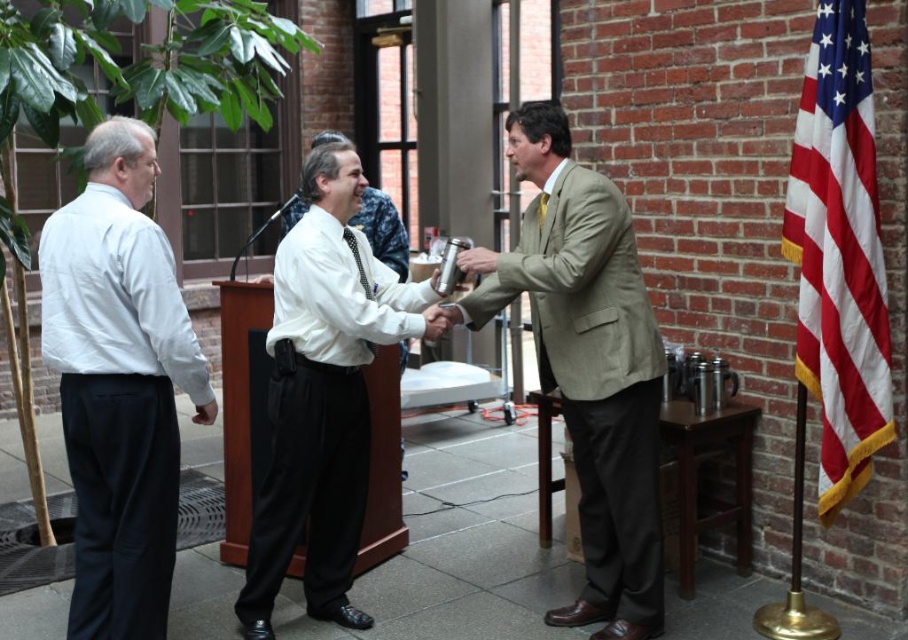
Question: Is white shirt at center above matte black tie at center?

Choices:
 (A) no
 (B) yes

Answer: (A)

Question: Which of the following is the closest to the observer?

Choices:
 (A) (465, 253)
 (B) (336, 168)
 (C) (75, 435)

Answer: (C)

Question: Which object appears farthest from the camera in this image?

Choices:
 (A) white shirt at center
 (B) metallic silver cup at center

Answer: (B)

Question: Is matte beige suit at center positioned before matte silver cup at center?

Choices:
 (A) no
 (B) yes

Answer: (B)

Question: Which point is farther to the camera?

Choices:
 (A) white cotton shirt at left
 (B) matte beige suit at center

Answer: (B)

Question: Does white shirt at center have a smaller size compared to matte black tie at center?

Choices:
 (A) no
 (B) yes

Answer: (A)